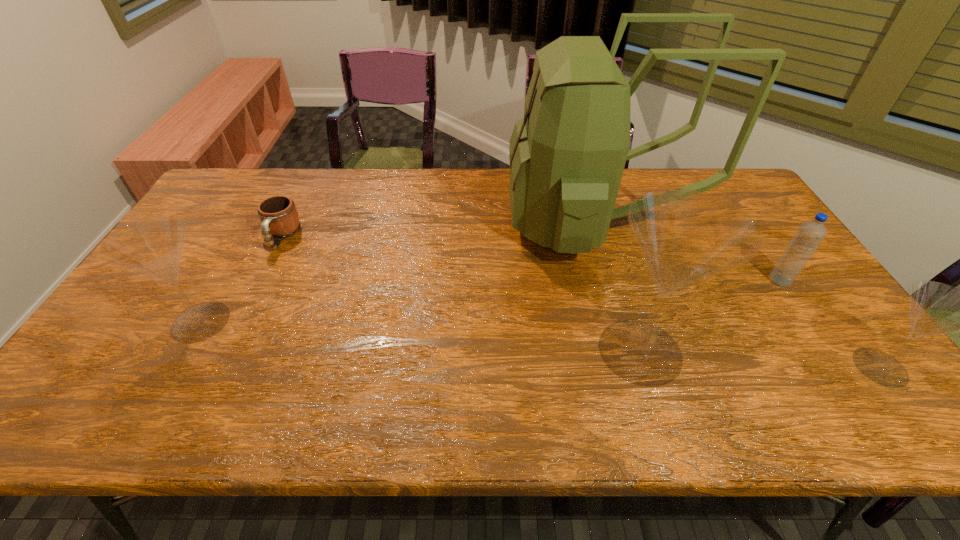
Identify the location of free space in the image that satisfies the following two spatial constraints: 1. on the front pocket of the backpack; 2. on the right side of the rightmost object. (636, 367).

Find the location of a particular element. free spot that satisfies the following two spatial constraints: 1. on the front pocket of the tallest object; 2. on the back side of the fifth shortest object is located at coordinates (631, 351).

Locate an element on the screen. vacant space that satisfies the following two spatial constraints: 1. on the front pocket of the tallest object; 2. on the front side of the second tallest flute glass is located at coordinates (622, 322).

The height and width of the screenshot is (540, 960). I want to click on free location that satisfies the following two spatial constraints: 1. on the front side of the shortest flute glass; 2. on the right side of the tallest flute glass, so click(645, 367).

Identify the location of vacant point that satisfies the following two spatial constraints: 1. on the back side of the fifth shortest object; 2. on the right side of the water bottle. This screenshot has width=960, height=540. pos(618,280).

Find the location of `vacant space that satisfies the following two spatial constraints: 1. on the side of the mug with the handle; 2. on the left side of the rightmost object`. vacant space that satisfies the following two spatial constraints: 1. on the side of the mug with the handle; 2. on the left side of the rightmost object is located at coordinates (218, 367).

At what (x,y) coordinates should I click in order to perform the action: click on blank space that satisfies the following two spatial constraints: 1. on the back side of the rightmost object; 2. on the front pocket of the backpack. Please return your answer as a coordinate pair (x, y). Image resolution: width=960 pixels, height=540 pixels. Looking at the image, I should click on (773, 224).

I want to click on free location that satisfies the following two spatial constraints: 1. on the side of the rightmost object with the handle; 2. on the right side of the shortest object, so click(x=218, y=367).

You are a GUI agent. You are given a task and a screenshot of the screen. Output one action in this format:
    pyautogui.click(x=<x>, y=<y>)
    Task: Click on the vacant area in the image that satisfies the following two spatial constraints: 1. on the side of the tallest flute glass with the handle; 2. on the right side of the mug
    The height and width of the screenshot is (540, 960).
    Given the screenshot: What is the action you would take?
    pyautogui.click(x=226, y=351)

I want to click on vacant space that satisfies the following two spatial constraints: 1. on the front pocket of the tallest object; 2. on the back side of the fifth object from left to right, so click(611, 280).